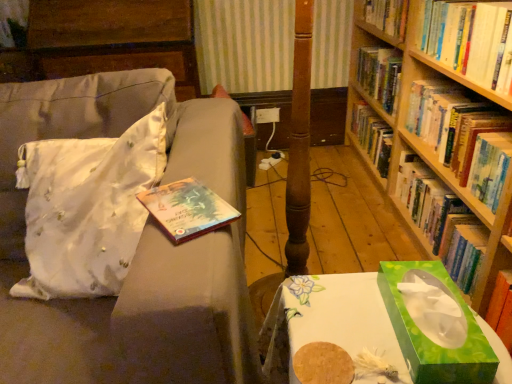
Question: From a real-world perspective, is hardcover book at upper right, marked as the 3th book in a top-to-bottom arrangement, positioned above or below green paper tissue box at lower right?

Choices:
 (A) below
 (B) above

Answer: (A)

Question: Does point (407, 173) appear closer or farther from the camera than point (482, 345)?

Choices:
 (A) closer
 (B) farther

Answer: (B)

Question: Which object is positioned farthest from the green wooden bookcase at right?

Choices:
 (A) hardcover book at right, acting as the second book starting from the top
 (B) white glossy table at lower right
 (C) hardcover book at upper right, acting as the 1th book starting from the bottom
 (D) white satin throw pillow at left
 (E) satin beige couch at left

Answer: (D)

Question: Based on their relative distances, which object is nearer to the hardcover book at right, marked as the 2th book in a bottom-to-top arrangement?

Choices:
 (A) green wooden bookcase at right
 (B) white satin throw pillow at left
 (C) white glossy table at lower right
 (D) hardcover book at upper right, acting as the 1th book starting from the bottom
 (E) hardcover book at upper right, which is the third book in bottom-to-top order

Answer: (A)